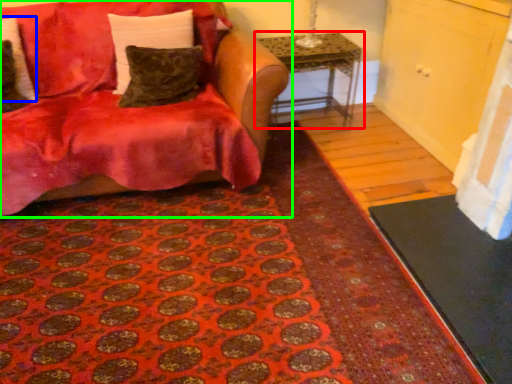
Question: Which object is the closest to the table (highlighted by a red box)? Choose among these: pillow (highlighted by a blue box) or studio couch (highlighted by a green box).

Choices:
 (A) pillow
 (B) studio couch

Answer: (B)